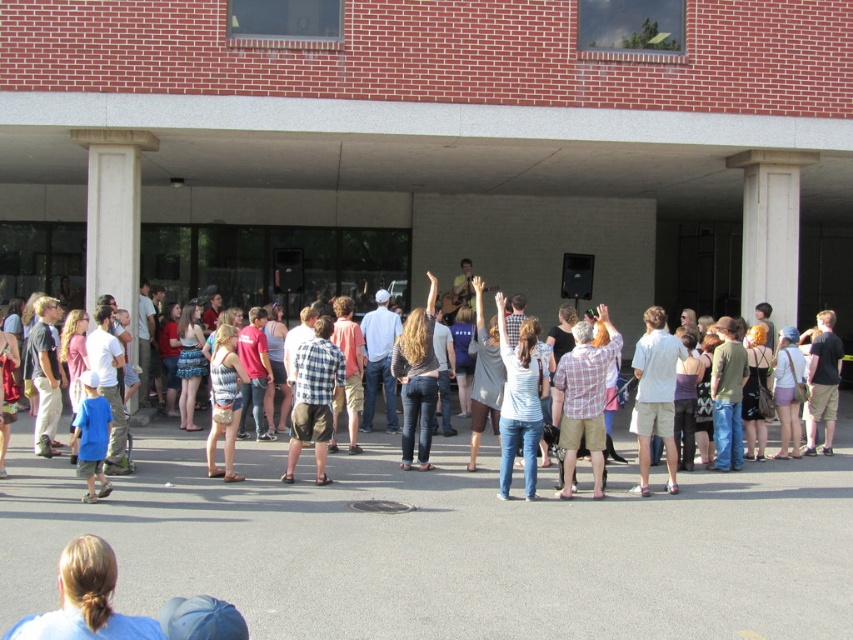
Based on the photo, you are a photographer standing at the back of the crowd. You want to take a photo of the white concrete column at center without any obstruction. Is the denim jeans at center blocking your view of the column?

The denim jeans at center is located below the white concrete column at center, so it will not block your view of the column as it is positioned lower down.

You are standing at the point marked by the coordinates point (401,486) in the image, which is near the denim jeans at center. You want to move to the brick building with large glass windows in the background. Which direction should you walk to reach the building?

The point (401,486) is at the center, so you should walk forward towards the brick building with large glass windows in the background.